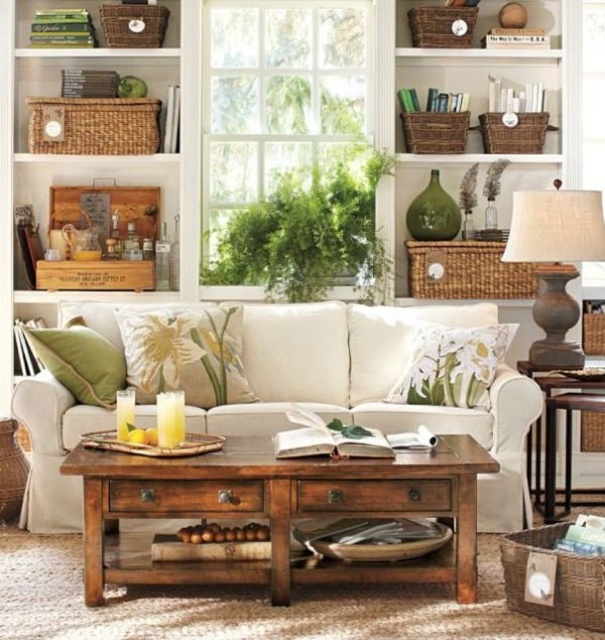
Between floral fabric pillow at center and green fabric pillow at left, which one appears on the left side from the viewer's perspective?

green fabric pillow at left is more to the left.

Between point (232, 321) and point (62, 360), which one is positioned behind?

Positioned behind is point (232, 321).

What do you see at coordinates (185, 353) in the screenshot?
I see `floral fabric pillow at center` at bounding box center [185, 353].

In order to click on floral fabric pillow at center in this screenshot , I will do `click(185, 353)`.

The width and height of the screenshot is (605, 640). What do you see at coordinates (557, 438) in the screenshot? I see `black wood side table at right` at bounding box center [557, 438].

In the scene shown: Between black wood side table at right and green matte bookshelf at upper left, which one appears on the left side from the viewer's perspective?

Positioned to the left is green matte bookshelf at upper left.

This screenshot has height=640, width=605. What are the coordinates of `black wood side table at right` in the screenshot? It's located at 557,438.

Where is `black wood side table at right`? This screenshot has height=640, width=605. black wood side table at right is located at coordinates (557, 438).

Is rustic wood couch at center further to the viewer compared to black wood side table at right?

No.

Can you confirm if rustic wood couch at center is positioned to the left of black wood side table at right?

Correct, you'll find rustic wood couch at center to the left of black wood side table at right.

Who is more forward, (281, 337) or (543, 406)?

Positioned in front is point (281, 337).

This screenshot has height=640, width=605. In order to click on rustic wood couch at center in this screenshot , I will do `click(374, 387)`.